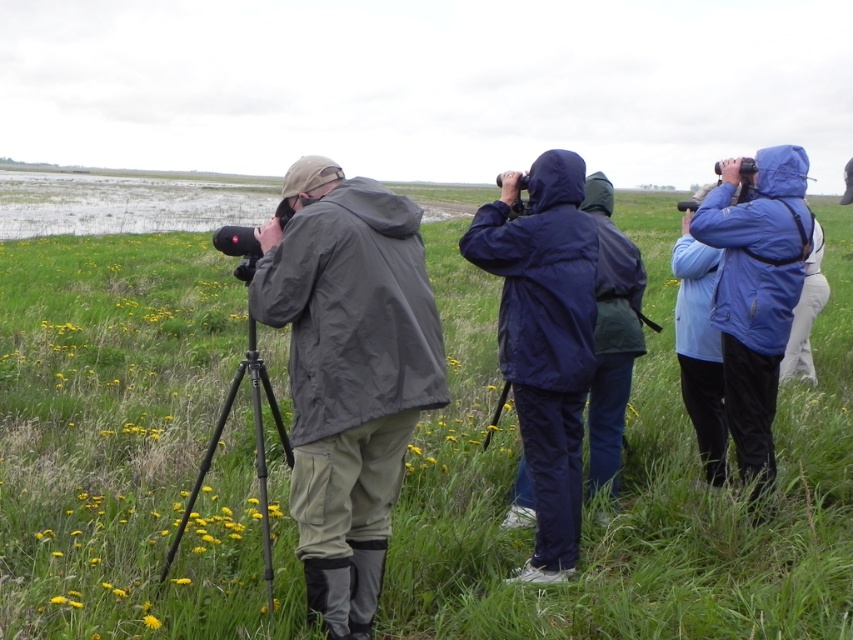
Question: Can you confirm if blue matte jacket at right is wider than black matte tripod at center?

Choices:
 (A) yes
 (B) no

Answer: (B)

Question: Is matte black jacket at center to the left of black matte tripod at center from the viewer's perspective?

Choices:
 (A) no
 (B) yes

Answer: (A)

Question: Which point is closer to the camera?

Choices:
 (A) (257, 461)
 (B) (779, 348)
 (C) (526, 429)

Answer: (C)

Question: From the image, what is the correct spatial relationship of green grassy at center in relation to matte black jacket at center?

Choices:
 (A) above
 (B) below

Answer: (A)

Question: Which point is closer to the camera?

Choices:
 (A) (735, 349)
 (B) (265, 385)

Answer: (B)

Question: Estimate the real-world distances between objects in this image. Which object is closer to the black matte tripod at center?

Choices:
 (A) navy blue raincoat at center
 (B) matte black jacket at center

Answer: (B)